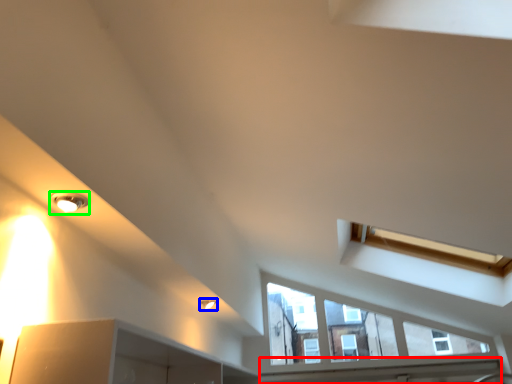
Question: Which object is the closest to the window sill (highlighted by a red box)? Choose among these: light fixture (highlighted by a blue box) or light fixture (highlighted by a green box).

Choices:
 (A) light fixture
 (B) light fixture

Answer: (A)